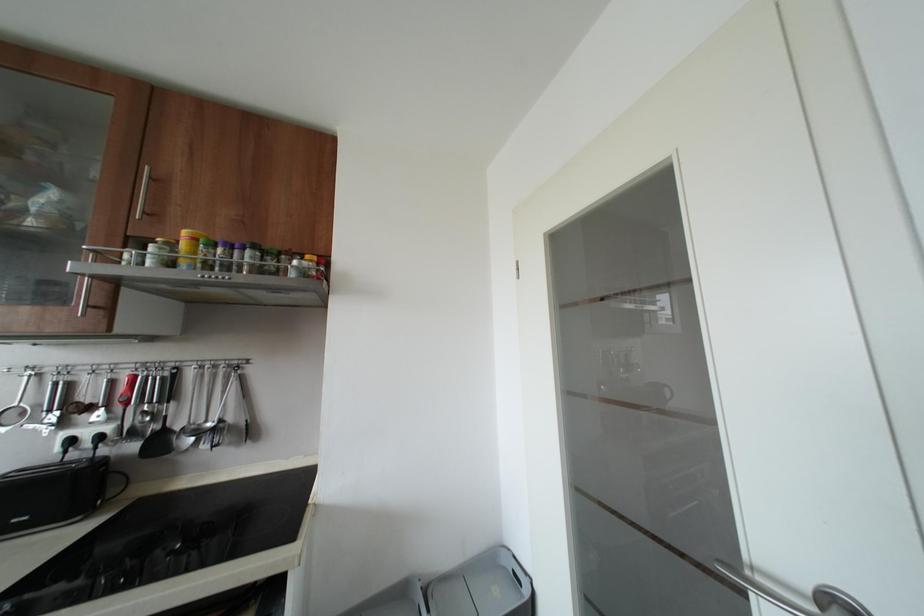
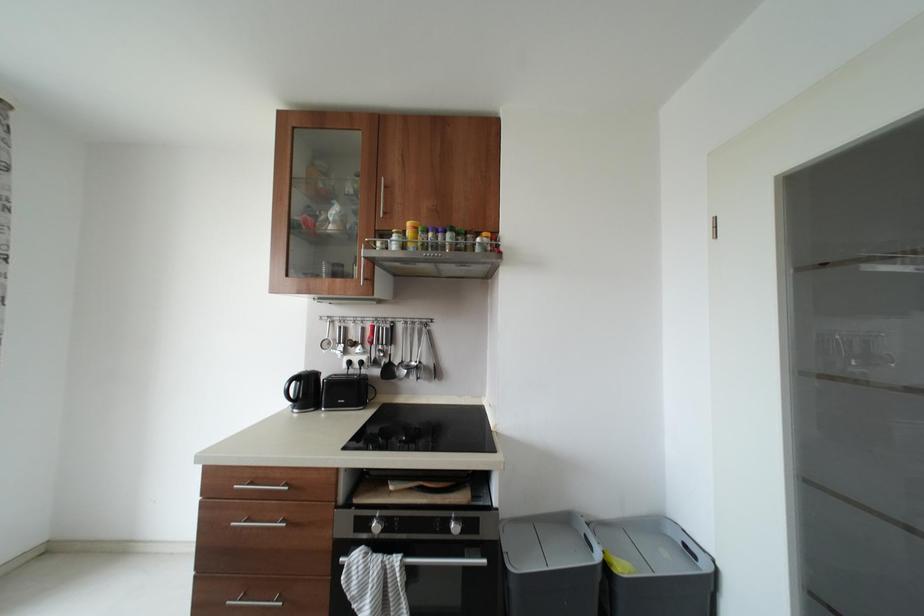
Question: How did the camera likely rotate?

Choices:
 (A) Left
 (B) Right
 (C) Up
 (D) Down

Answer: (A)